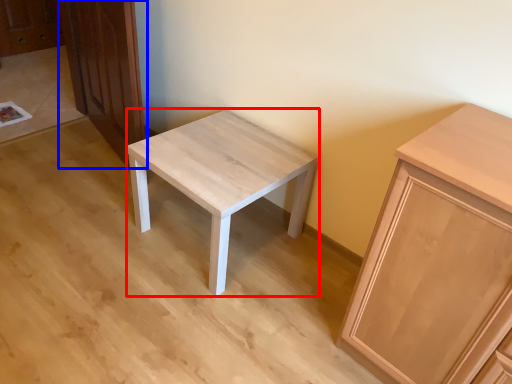
Question: Which of the following is the farthest to the observer, stool (highlighted by a red box) or dresser (highlighted by a blue box)?

Choices:
 (A) stool
 (B) dresser

Answer: (B)